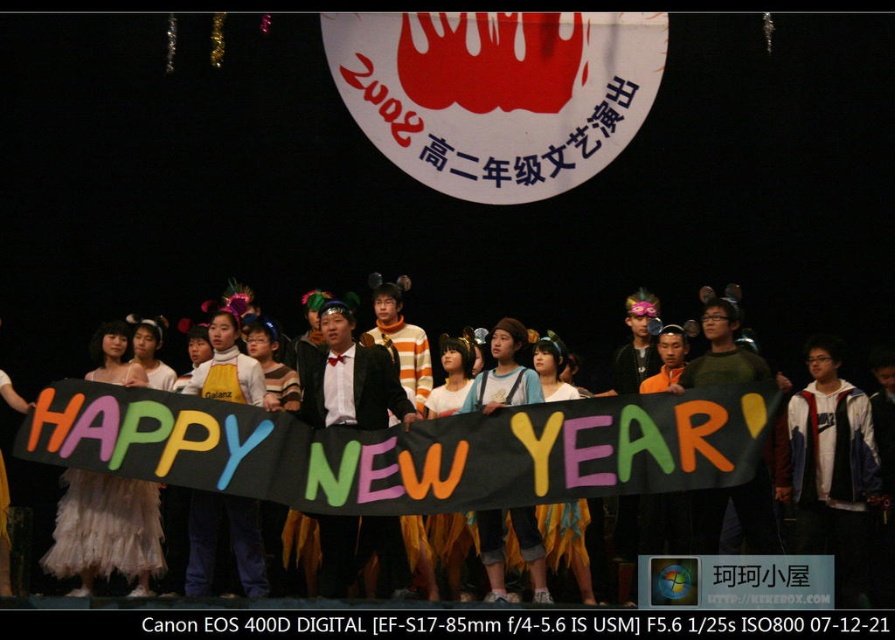
You are a photographer trying to capture the white matte dress at center and the white fluffy dress at center in a clear photo. Which dress should you focus on to ensure it appears in front of the other?

The white matte dress at center is positioned over white fluffy dress at center, so focusing on the white matte dress at center will ensure it appears in front.